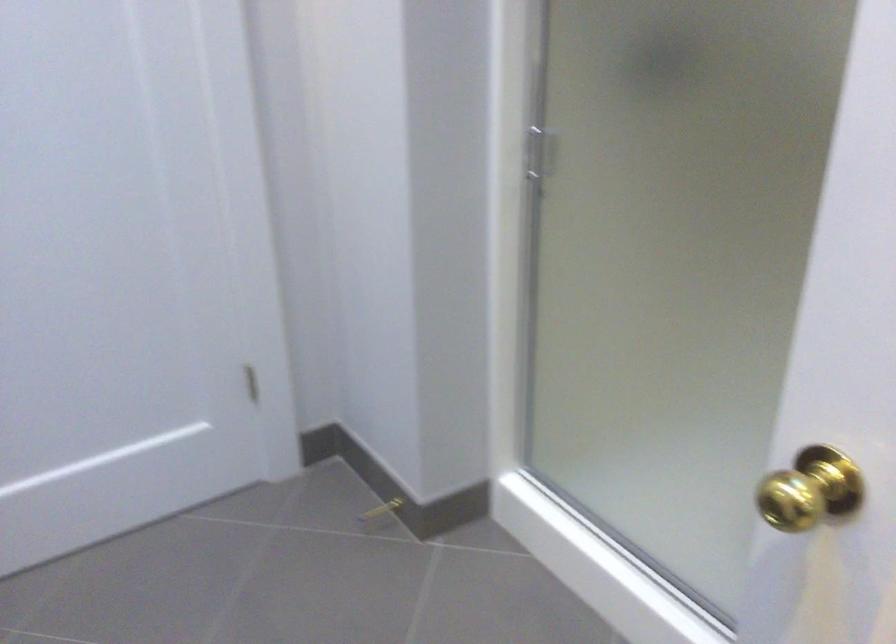
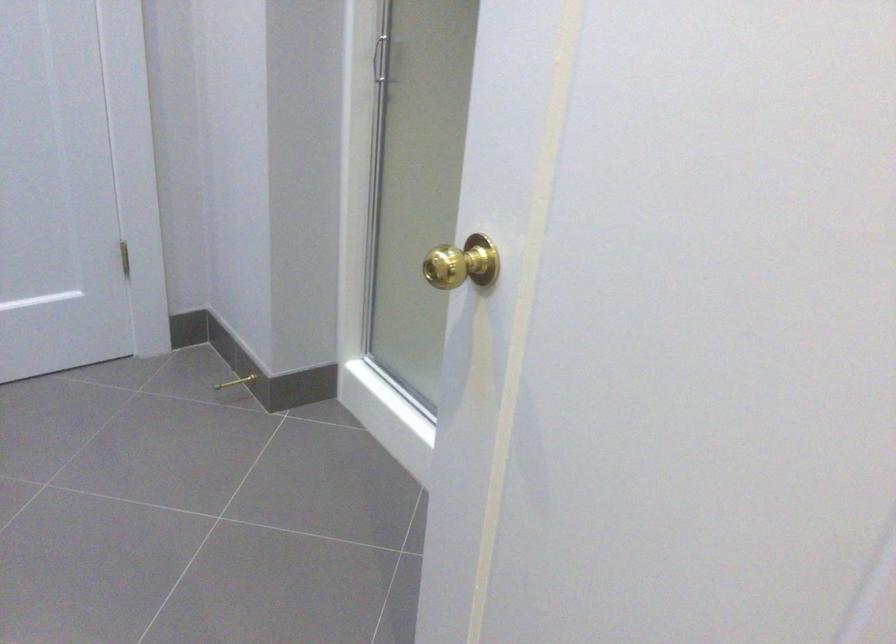
In a continuous first-person perspective shot, in which direction is the camera moving?

The cameraman walked toward right, backward.